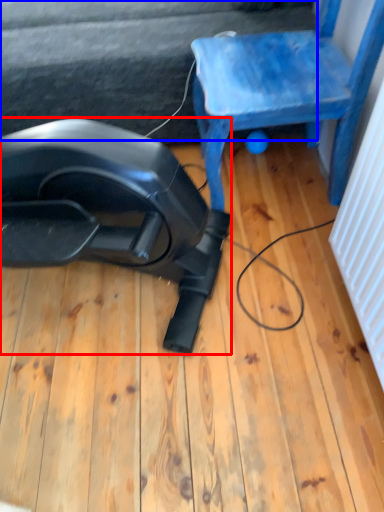
Question: Which object appears closest to the camera in this image, equipment (highlighted by a red box) or surface (highlighted by a blue box)?

Choices:
 (A) equipment
 (B) surface

Answer: (A)